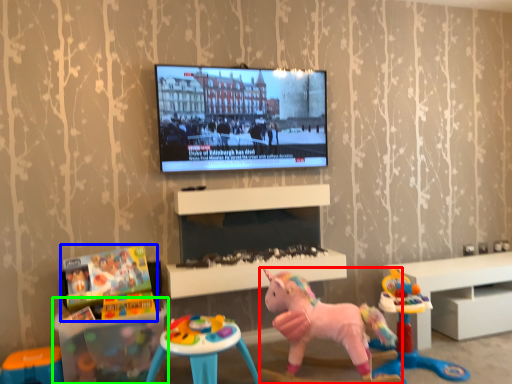
Question: Which is farther away from toy (highlighted by a red box)? toy (highlighted by a blue box) or table (highlighted by a green box)?

Choices:
 (A) toy
 (B) table

Answer: (A)